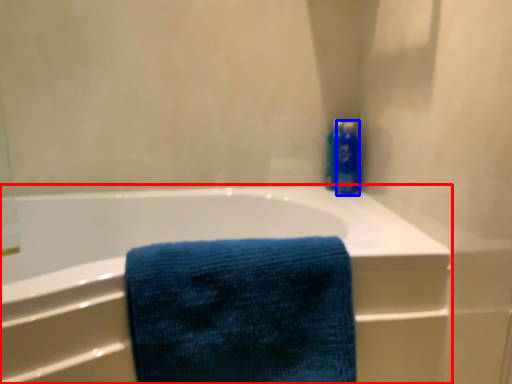
Question: Which of the following is the closest to the observer, bathtub (highlighted by a red box) or cleaning product (highlighted by a blue box)?

Choices:
 (A) bathtub
 (B) cleaning product

Answer: (A)